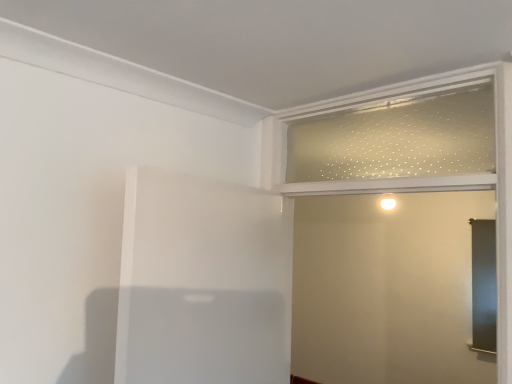
Question: From a real-world perspective, is clear frosted glass screen door at upper right on top of white matte elevator at center?

Choices:
 (A) yes
 (B) no

Answer: (A)

Question: Is clear frosted glass screen door at upper right at the left side of white matte elevator at center?

Choices:
 (A) yes
 (B) no

Answer: (B)

Question: Can we say clear frosted glass screen door at upper right lies outside white matte elevator at center?

Choices:
 (A) no
 (B) yes

Answer: (B)

Question: Is clear frosted glass screen door at upper right at the right side of white matte elevator at center?

Choices:
 (A) yes
 (B) no

Answer: (A)

Question: Does clear frosted glass screen door at upper right lie in front of white matte elevator at center?

Choices:
 (A) no
 (B) yes

Answer: (A)

Question: Is clear glass window frame at upper right wider or thinner than white matte elevator at center?

Choices:
 (A) wide
 (B) thin

Answer: (B)

Question: Is clear glass window frame at upper right in front of or behind white matte elevator at center in the image?

Choices:
 (A) behind
 (B) front

Answer: (A)

Question: Would you say clear glass window frame at upper right is inside or outside white matte elevator at center?

Choices:
 (A) inside
 (B) outside

Answer: (B)

Question: Considering the positions of clear glass window frame at upper right and white matte elevator at center in the image, is clear glass window frame at upper right taller or shorter than white matte elevator at center?

Choices:
 (A) short
 (B) tall

Answer: (A)

Question: From the image's perspective, is clear frosted glass screen door at upper right above or below white matte elevator at center?

Choices:
 (A) below
 (B) above

Answer: (B)

Question: From a real-world perspective, is clear frosted glass screen door at upper right positioned above or below white matte elevator at center?

Choices:
 (A) below
 (B) above

Answer: (B)

Question: Considering the relative positions of clear frosted glass screen door at upper right and white matte elevator at center in the image provided, is clear frosted glass screen door at upper right to the left or to the right of white matte elevator at center?

Choices:
 (A) right
 (B) left

Answer: (A)

Question: Is clear frosted glass screen door at upper right taller or shorter than white matte elevator at center?

Choices:
 (A) short
 (B) tall

Answer: (B)

Question: From a real-world perspective, is clear glass window frame at upper right physically located above or below clear frosted glass screen door at upper right?

Choices:
 (A) below
 (B) above

Answer: (B)

Question: Is clear glass window frame at upper right taller or shorter than clear frosted glass screen door at upper right?

Choices:
 (A) tall
 (B) short

Answer: (B)